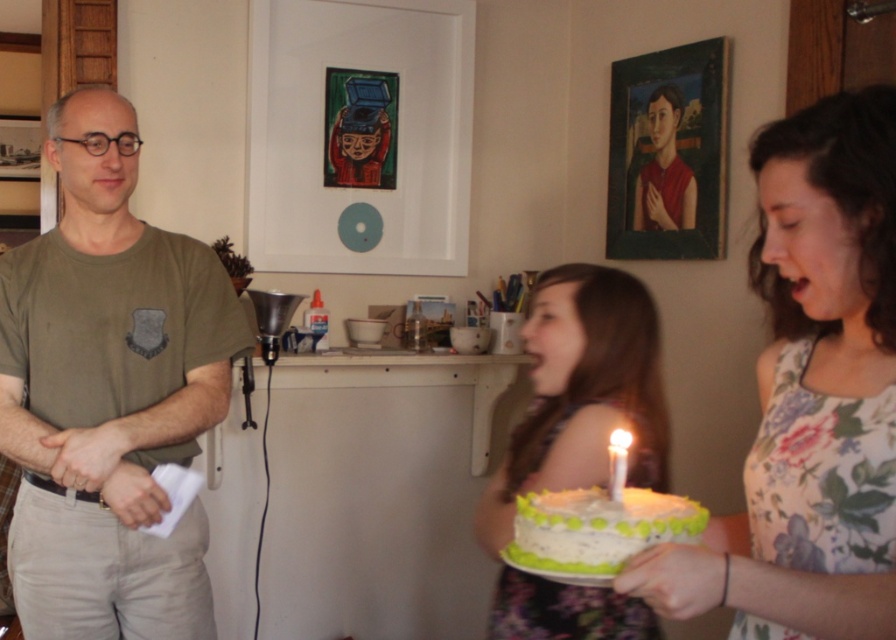
Question: Which point is farther from the camera taking this photo?

Choices:
 (A) pos(658,188)
 (B) pos(573,368)
 (C) pos(556,516)
 (D) pos(622,467)

Answer: (A)

Question: Which of these objects is positioned closest to the floral fabric dress at center?

Choices:
 (A) white frosted cake at center
 (B) white wax candle at center

Answer: (B)

Question: Is green matte t-shirt at left positioned in front of white frosted cake at center?

Choices:
 (A) yes
 (B) no

Answer: (B)

Question: Can you confirm if green matte t-shirt at left is positioned below white wax candle at center?

Choices:
 (A) no
 (B) yes

Answer: (A)

Question: From the image, what is the correct spatial relationship of floral fabric dress at center in relation to matte black shirt at center?

Choices:
 (A) below
 (B) above

Answer: (A)

Question: Which object is farther from the camera taking this photo?

Choices:
 (A) matte black shirt at center
 (B) green frosted cake at center

Answer: (A)